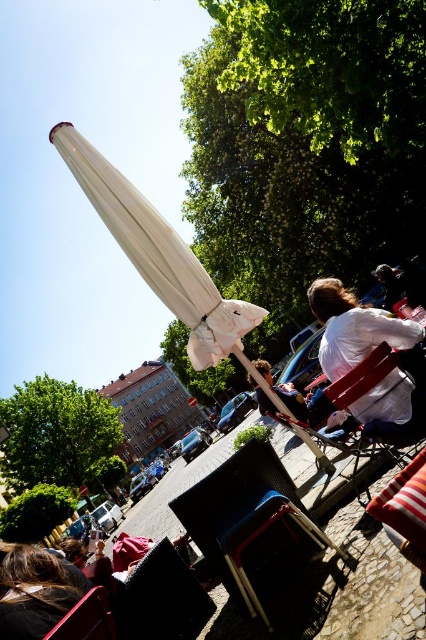
Question: Can you confirm if black plastic beach chair at center is positioned below white cotton shirt at right?

Choices:
 (A) no
 (B) yes

Answer: (B)

Question: Can you confirm if white fabric umbrella at upper center is bigger than black textured cushion at lower center?

Choices:
 (A) no
 (B) yes

Answer: (A)

Question: Where is black textured cushion at lower center located in relation to matte pink shirt at lower left in the image?

Choices:
 (A) left
 (B) right

Answer: (B)

Question: Which object is positioned farthest from the white cotton shirt at right?

Choices:
 (A) black plastic beach chair at center
 (B) black textured cushion at lower center
 (C) matte black chair at lower left
 (D) white fabric umbrella at upper center

Answer: (D)

Question: Which point is closer to the camera?

Choices:
 (A) matte black chair at lower left
 (B) white cotton shirt at right

Answer: (A)

Question: Which point is farther to the camera?

Choices:
 (A) (380, 428)
 (B) (75, 544)

Answer: (B)